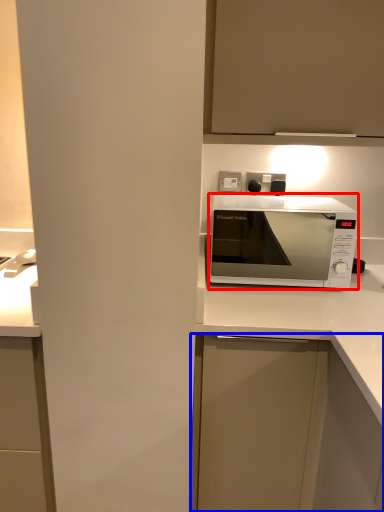
Question: Which object is further to the camera taking this photo, microwave oven (highlighted by a red box) or cabinetry (highlighted by a blue box)?

Choices:
 (A) microwave oven
 (B) cabinetry

Answer: (A)